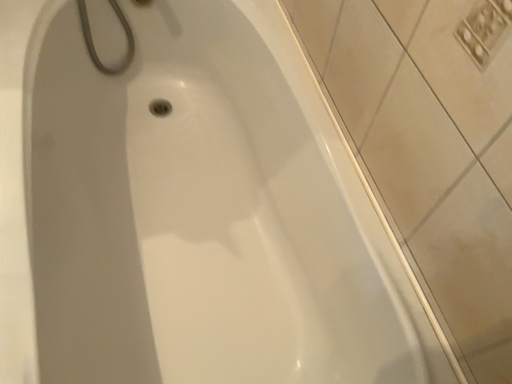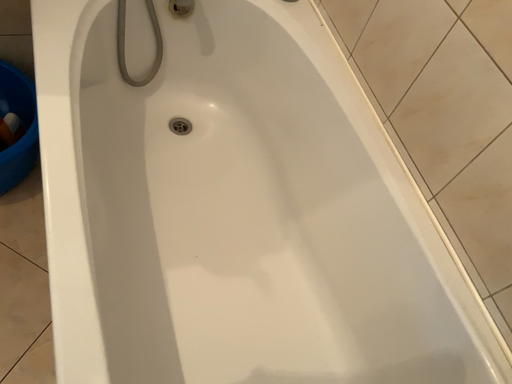
Question: Which way did the camera rotate in the video?

Choices:
 (A) rotated right
 (B) rotated left

Answer: (A)